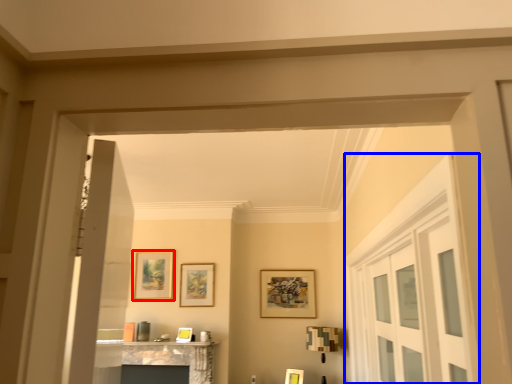
Question: Among these objects, which one is nearest to the camera, picture frame (highlighted by a red box) or door (highlighted by a blue box)?

Choices:
 (A) picture frame
 (B) door

Answer: (B)